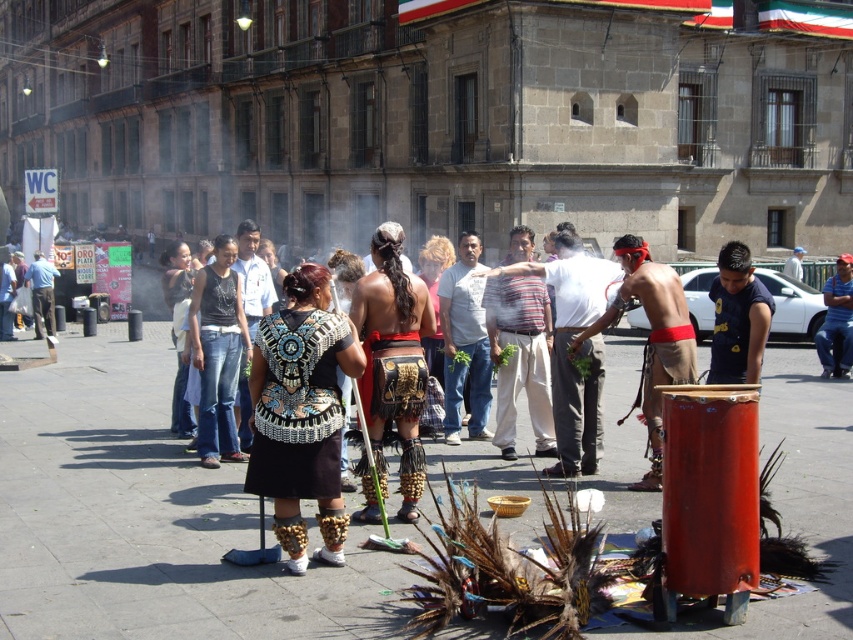
Question: Which of the following is the closest to the observer?

Choices:
 (A) shiny red cloth at center
 (B) dark blue shirt at center
 (C) shiny metallic drum at center

Answer: (A)

Question: Among these objects, which one is farthest from the camera?

Choices:
 (A) white shirt at center
 (B) shiny metallic vest at center
 (C) striped cotton shirt at center
 (D) denim jeans at center

Answer: (A)

Question: Which point appears farthest from the camera in this image?

Choices:
 (A) (450, 403)
 (B) (264, 266)
 (C) (662, 296)

Answer: (A)

Question: Can you confirm if gold beaded skirt at center is smaller than shiny red cloth at center?

Choices:
 (A) no
 (B) yes

Answer: (B)

Question: Can you confirm if gold beaded skirt at center is positioned below white shirt at center?

Choices:
 (A) no
 (B) yes

Answer: (B)

Question: Can you confirm if shiny metallic vest at center is thinner than shiny red cloth at center?

Choices:
 (A) yes
 (B) no

Answer: (A)